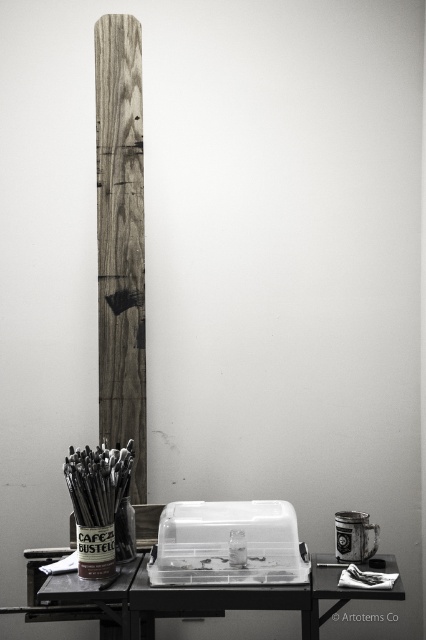
Can you confirm if wooden plank at left is shorter than black plastic table at lower center?

No, wooden plank at left is not shorter than black plastic table at lower center.

Can you confirm if wooden plank at left is positioned to the left of black plastic table at lower center?

Indeed, wooden plank at left is positioned on the left side of black plastic table at lower center.

Is point (115, 332) less distant than point (264, 596)?

No, (115, 332) is behind (264, 596).

Locate an element on the screen. wooden plank at left is located at coordinates (120, 237).